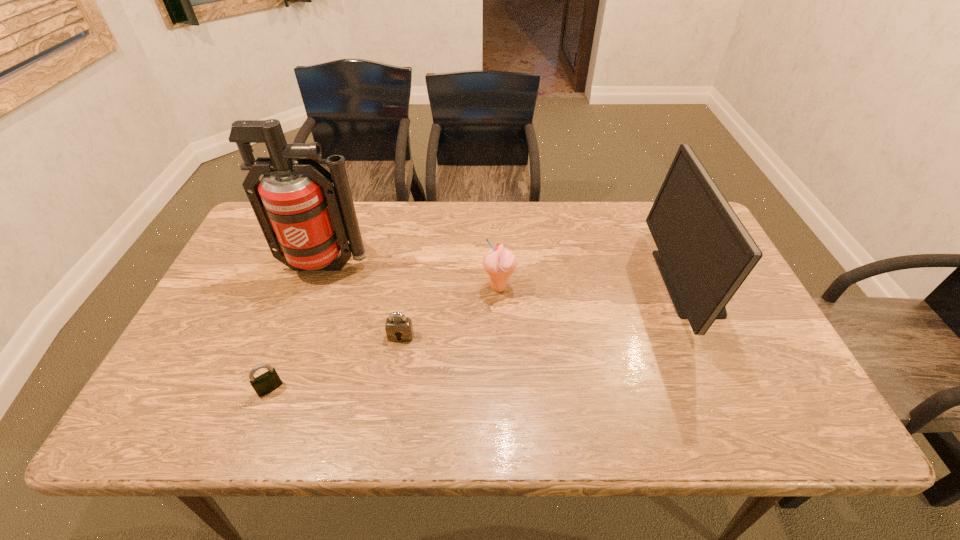
Locate an element on the screen. This screenshot has height=540, width=960. the tallest object is located at coordinates (304, 217).

The height and width of the screenshot is (540, 960). Find the location of `the fourth shortest object`. the fourth shortest object is located at coordinates (705, 253).

Identify the location of computer monitor. coord(705,253).

This screenshot has height=540, width=960. In order to click on the fourth object from left to right in this screenshot , I will do `click(499, 263)`.

This screenshot has height=540, width=960. In order to click on icecream in this screenshot , I will do `click(499, 263)`.

Locate an element on the screen. Image resolution: width=960 pixels, height=540 pixels. the third object from right to left is located at coordinates (399, 328).

I want to click on the farther padlock, so click(399, 328).

At what (x,y) coordinates should I click in order to perform the action: click on the left padlock. Please return your answer as a coordinate pair (x, y). Looking at the image, I should click on 269,381.

The image size is (960, 540). In order to click on the nearer padlock in this screenshot , I will do `click(269, 381)`.

The height and width of the screenshot is (540, 960). In order to click on vacant region located on the front label side of the tallest object in this screenshot , I will do `click(290, 364)`.